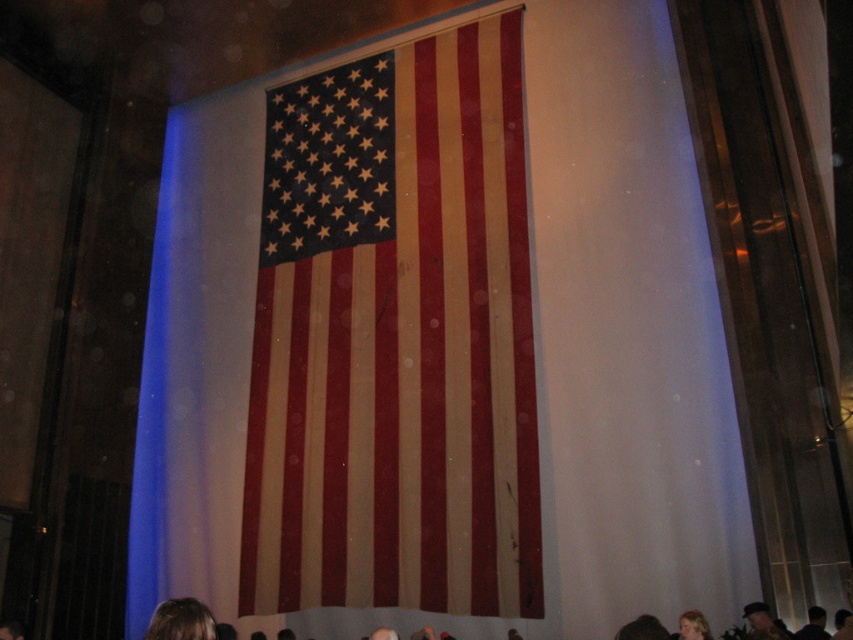
You are a photographer trying to capture a group photo of the people with their heads visible in the foreground and the matte fabric flag at center in the background. Since the flag is taller than the dark hair at lower center, how should you position the camera to ensure both the flag and the people are fully visible in the photo?

The matte fabric flag at center is taller than the dark hair at lower center. To capture both fully, position the camera so the flag occupies the upper part of the frame and the people with dark hair at lower center are at the bottom, ensuring the entire height of both subjects fits within the camera view.

You are a photographer at the event and need to capture a photo that includes both the blonde hair at lower left and the dark brown hair at lower center. Based on their positions, can you fit both people into the frame without moving your camera position?

The blonde hair at lower left and dark brown hair at lower center are 1.49 meters apart. Since the distance between them is less than the camera frame width, you can fit both into the frame without moving the camera position.